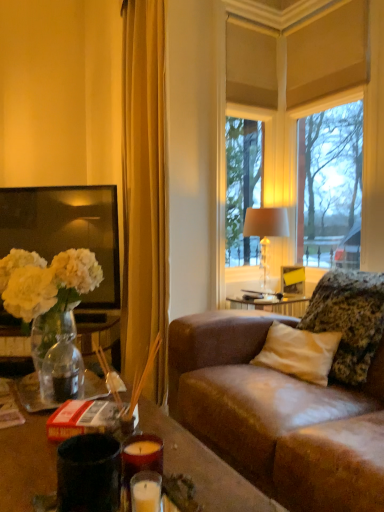
Question: Is matte red candle at lower center bigger or smaller than fluffy textured pillow at right?

Choices:
 (A) small
 (B) big

Answer: (A)

Question: Considering the positions of matte red candle at lower center and fluffy textured pillow at right in the image, is matte red candle at lower center wider or thinner than fluffy textured pillow at right?

Choices:
 (A) wide
 (B) thin

Answer: (B)

Question: Estimate the real-world distances between objects in this image. Which object is closer to the fluffy textured pillow at right?

Choices:
 (A) translucent glass vase at left
 (B) translucent glass lamp at center
 (C) clear glass window at center
 (D) matte red candle at lower center

Answer: (B)

Question: Which is nearer to the fluffy textured pillow at right?

Choices:
 (A) translucent glass lamp at center
 (B) clear glass window at center
 (C) translucent glass vase at left
 (D) matte red candle at lower center

Answer: (A)